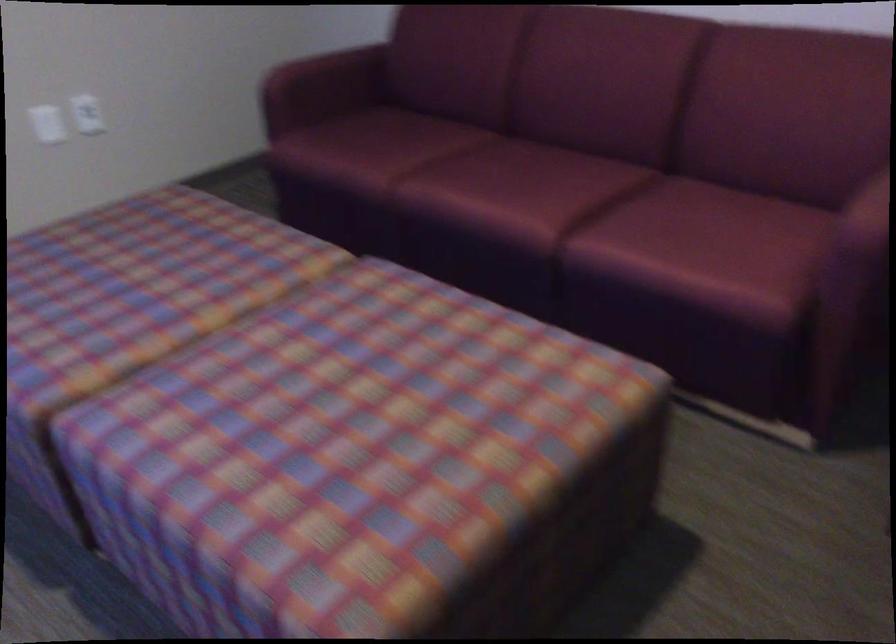
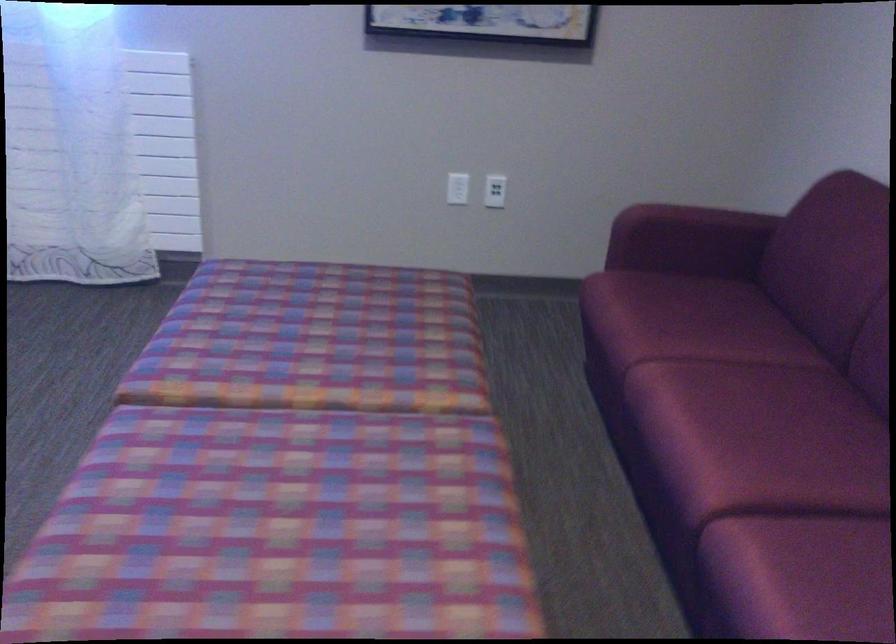
Locate, in the second image, the point that corresponds to point 543,189 in the first image.

(764, 456)